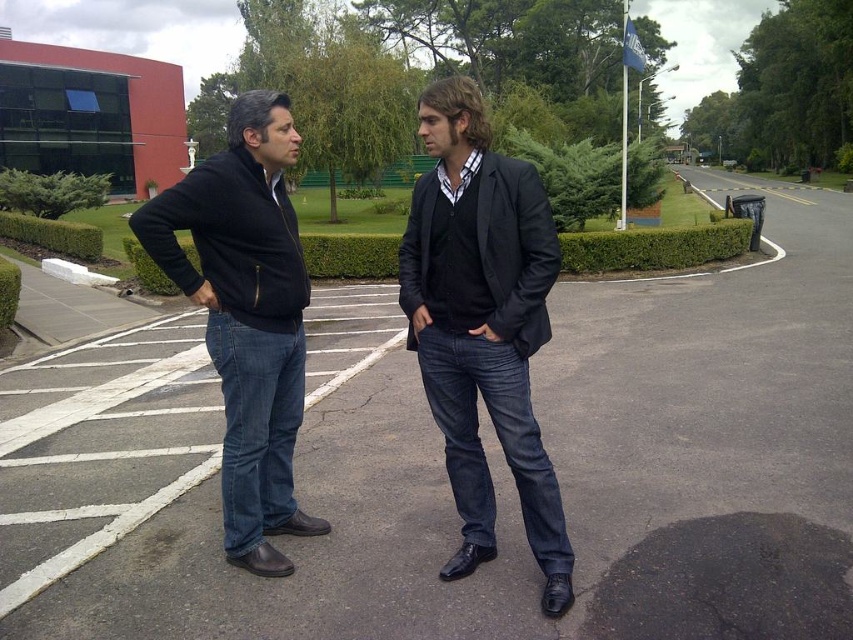
Which of these two, dark asphalt parking lot at center or matte black blazer at center, stands taller?

Standing taller between the two is dark asphalt parking lot at center.

Can you confirm if dark asphalt parking lot at center is bigger than matte black blazer at center?

Yes.

Is point (738, 520) positioned in front of point (502, 326)?

No, (738, 520) is behind (502, 326).

Find the location of a particular element. This screenshot has height=640, width=853. dark asphalt parking lot at center is located at coordinates (560, 481).

Does dark asphalt parking lot at center appear over dark blue jeans at center?

Yes, dark asphalt parking lot at center is above dark blue jeans at center.

Can you confirm if dark asphalt parking lot at center is positioned to the right of dark blue jeans at center?

Yes, dark asphalt parking lot at center is to the right of dark blue jeans at center.

The width and height of the screenshot is (853, 640). I want to click on dark asphalt parking lot at center, so click(560, 481).

Consider the image. Who is positioned more to the left, matte black blazer at center or dark blue jeans at center?

Positioned to the left is dark blue jeans at center.

Find the location of a particular element. matte black blazer at center is located at coordinates click(x=483, y=324).

I want to click on matte black blazer at center, so click(483, 324).